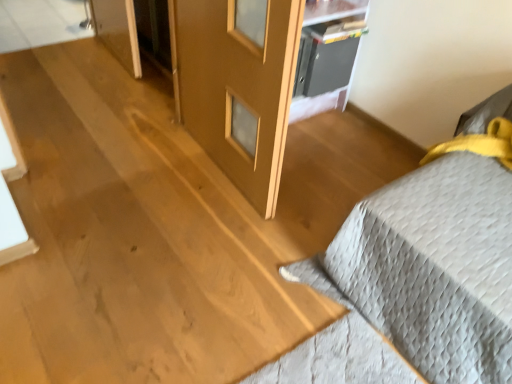
Question: From a real-world perspective, relative to gray quilted bedspread at right, is matte wood screen door at center vertically above or below?

Choices:
 (A) below
 (B) above

Answer: (B)

Question: Considering their positions, is matte wood screen door at center located in front of or behind gray quilted bedspread at right?

Choices:
 (A) front
 (B) behind

Answer: (B)

Question: Which is nearer to the metallic gray cabinet at upper center?

Choices:
 (A) gray quilted bedspread at right
 (B) matte wood screen door at center

Answer: (B)

Question: Estimate the real-world distances between objects in this image. Which object is closer to the matte wood screen door at center?

Choices:
 (A) gray quilted bedspread at right
 (B) metallic gray cabinet at upper center

Answer: (B)